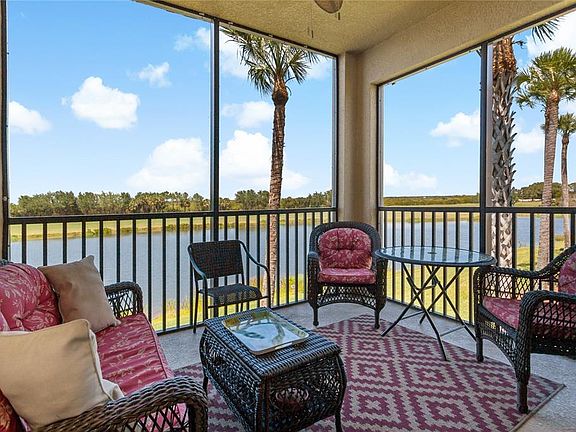
Where is `table`? The height and width of the screenshot is (432, 576). table is located at coordinates (447, 257).